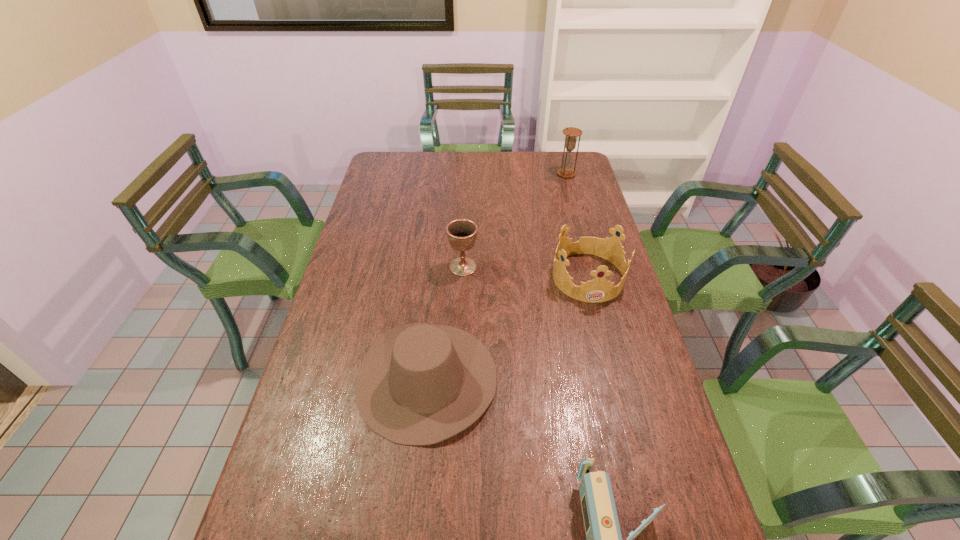
The height and width of the screenshot is (540, 960). Identify the location of the farthest object. (566, 171).

Image resolution: width=960 pixels, height=540 pixels. Find the location of `hourglass`. hourglass is located at coordinates (566, 171).

Locate an element on the screen. chalice is located at coordinates (461, 233).

Where is `tiara`? tiara is located at coordinates (598, 290).

In order to click on cowboy hat in this screenshot , I will do `click(419, 384)`.

The width and height of the screenshot is (960, 540). Find the location of `vacant space situated on the left of the tallest object`. vacant space situated on the left of the tallest object is located at coordinates (494, 174).

I want to click on blank area located on the back of the chalice, so click(465, 225).

The image size is (960, 540). What are the coordinates of `vacant area situated on the front-facing side of the tiara` in the screenshot? It's located at (620, 405).

Locate an element on the screen. vacant space situated 0.080m on the front of the fourth farthest object is located at coordinates [x=417, y=482].

You are a GUI agent. You are given a task and a screenshot of the screen. Output one action in this format:
    pyautogui.click(x=<x>, y=<y>)
    Task: Click on the object located in the far edge section of the desktop
    The width and height of the screenshot is (960, 540).
    Given the screenshot: What is the action you would take?
    pyautogui.click(x=566, y=171)